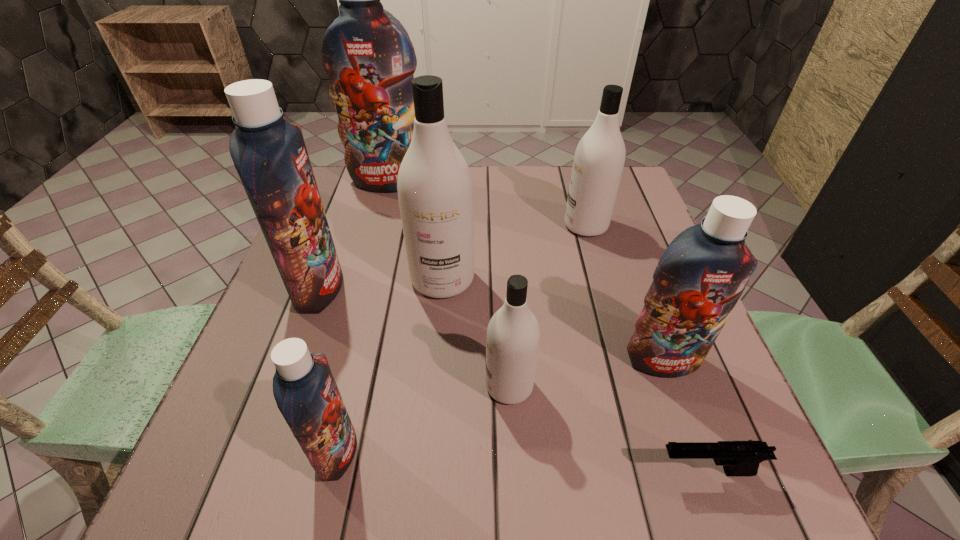
Locate an element on the screen. Image resolution: width=960 pixels, height=540 pixels. free location located on the front-facing side of the second smallest white shampoo is located at coordinates (525, 226).

Where is `vacant space located on the front label of the second nearest blue shampoo`? The image size is (960, 540). vacant space located on the front label of the second nearest blue shampoo is located at coordinates (692, 441).

Identify the location of free space located on the front label of the smallest blue shampoo. Image resolution: width=960 pixels, height=540 pixels. (550, 451).

In order to click on vacant area situated on the front-facing side of the third shampoo from right to left in this screenshot , I will do `click(420, 386)`.

At what (x,y) coordinates should I click in order to perform the action: click on free space located 0.260m on the front-facing side of the third shampoo from right to left. Please return your answer as a coordinate pair (x, y). The image size is (960, 540). Looking at the image, I should click on (345, 386).

The height and width of the screenshot is (540, 960). Find the location of `free space located 0.130m on the front-facing side of the third shampoo from right to left`. free space located 0.130m on the front-facing side of the third shampoo from right to left is located at coordinates (415, 386).

This screenshot has height=540, width=960. In order to click on vacant space located on the front-facing side of the black pistol in this screenshot , I will do `click(510, 471)`.

At what (x,y) coordinates should I click in order to perform the action: click on vacant space located 0.270m on the front-facing side of the black pistol. Please return your answer as a coordinate pair (x, y). Looking at the image, I should click on (485, 471).

Where is `vacant region located on the front-facing side of the black pistol`? This screenshot has height=540, width=960. vacant region located on the front-facing side of the black pistol is located at coordinates (622, 471).

Find the location of a particular element. The width and height of the screenshot is (960, 540). object that is positioned at the far edge is located at coordinates (366, 52).